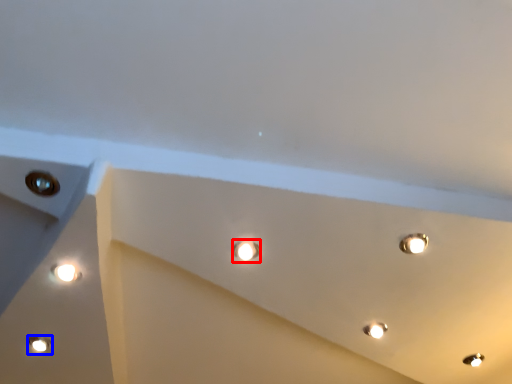
Question: Which object is closer to the camera taking this photo, droplight (highlighted by a red box) or lamp (highlighted by a blue box)?

Choices:
 (A) droplight
 (B) lamp

Answer: (A)